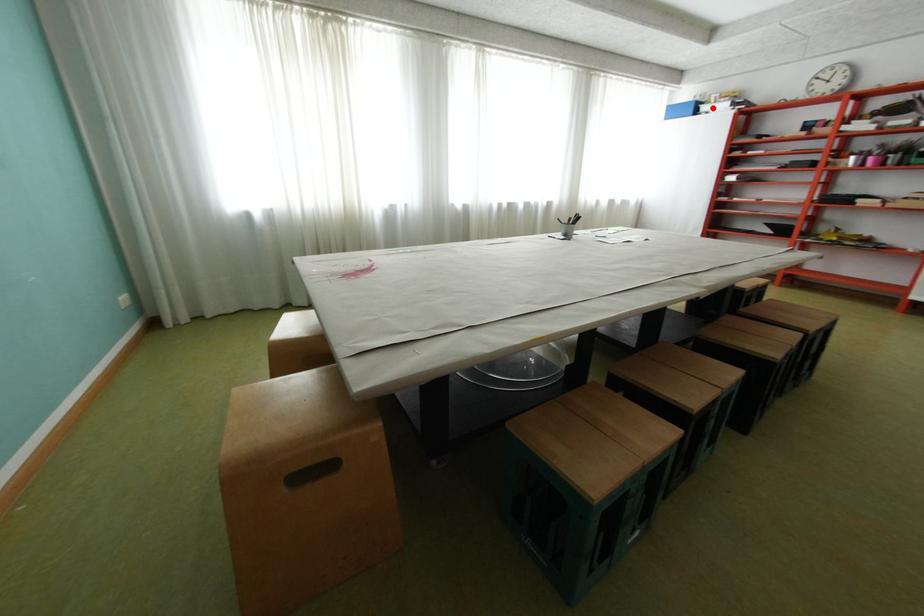
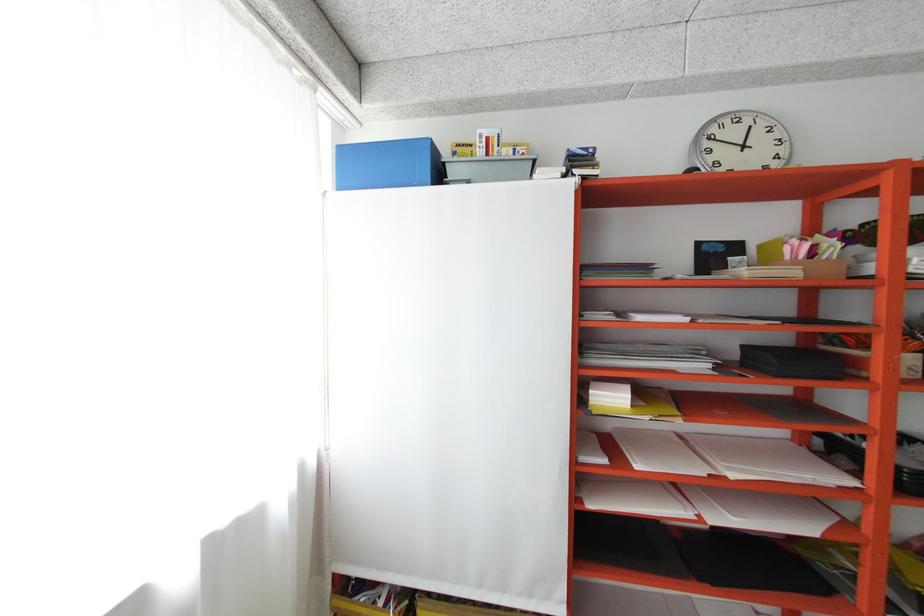
Locate, in the second image, the point that corresponds to the highlighted location in the first image.

(460, 172)